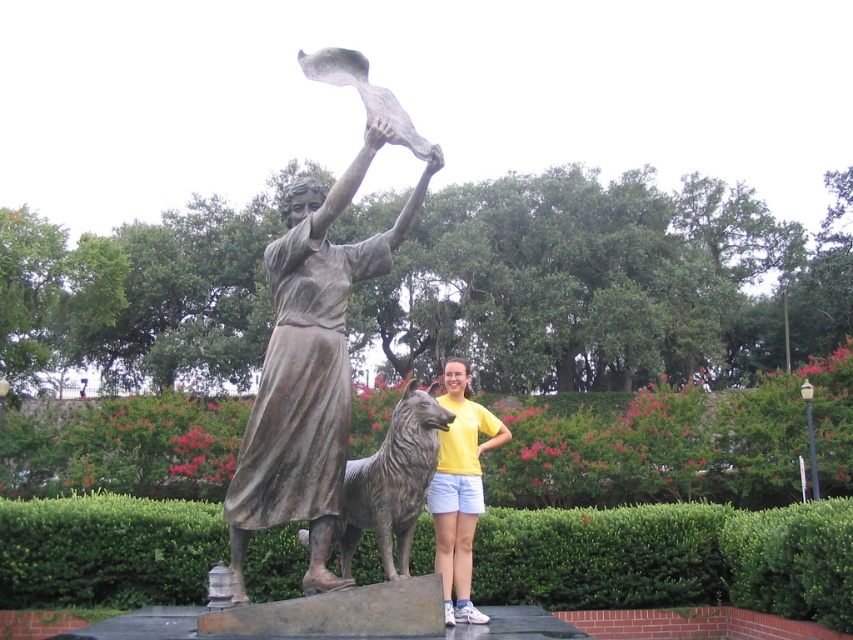
Based on the photo, who is lower down, bronze statue at center or yellow cotton shirt at center?

Positioned lower is yellow cotton shirt at center.

Locate an element on the screen. The width and height of the screenshot is (853, 640). bronze statue at center is located at coordinates (314, 339).